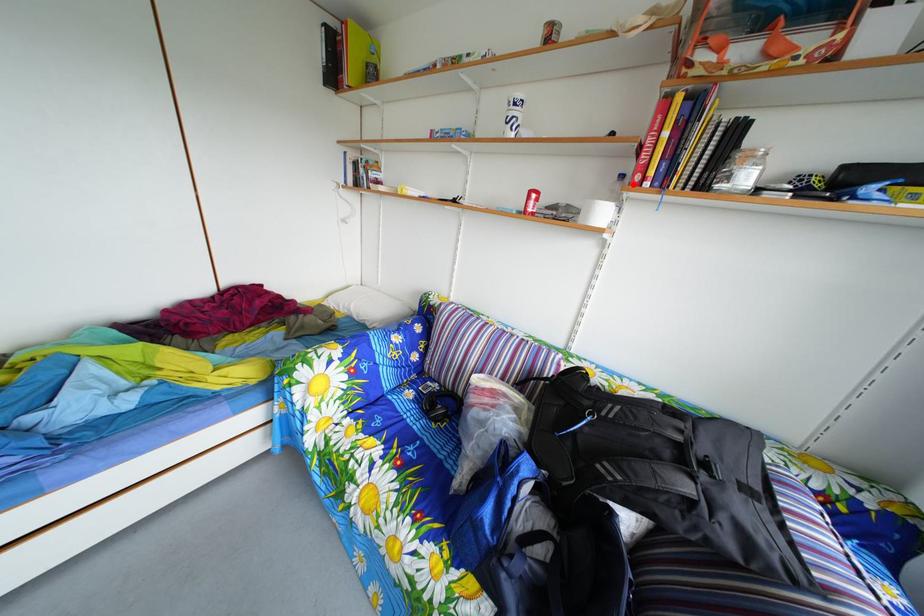
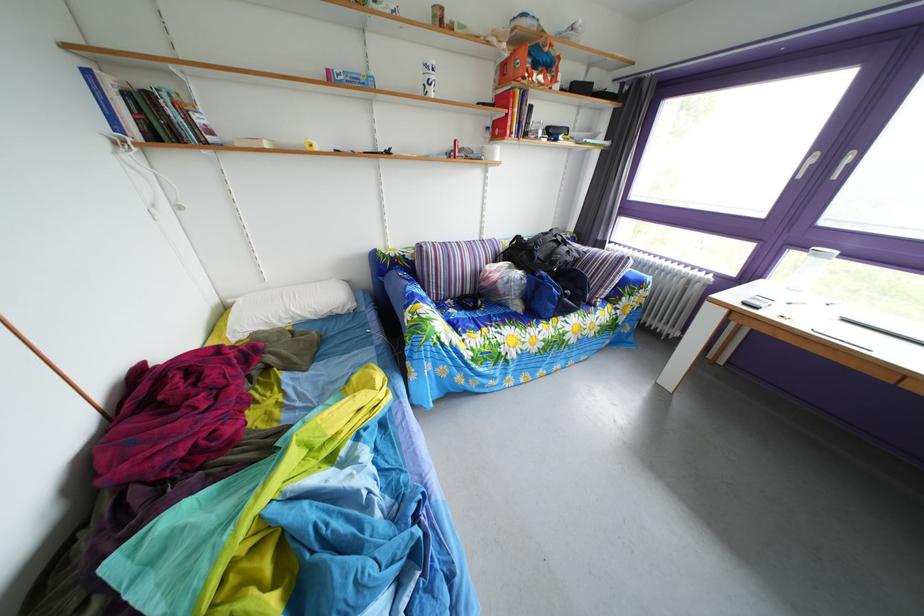
The point at the highlighted location is marked in the first image. Where is the corresponding point in the second image?

(499, 137)